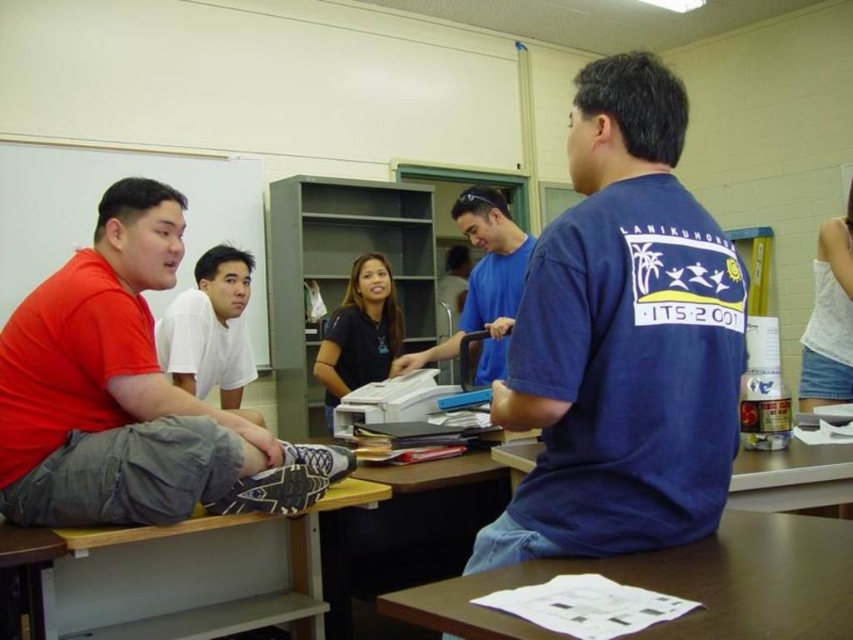
You are trying to place a large rectangular box on the wooden table at lower left. The box is as wide as the blue cotton shirt at center. Will the box fit on the table?

The wooden table at lower left might be wider than blue cotton shirt at center, so the box might fit if the table is wide enough. However, since the exact width difference isn t specified, there s uncertainty.

You are standing at the entrance of the room and want to greet the person in the blue cotton shirt at upper right. Which direction should you walk to approach them?

The blue cotton shirt at upper right is located at point 0.533 on the x axis and 0.730 on the y axis, so you should walk towards the upper right direction to approach them.

You are a person who needs to place a 15 cm tall book on the wooden table at lower left. Considering the height of the blue cotton shirt at center, will the book be visible from the front of the table?

The wooden table at lower left has a lesser height compared to blue cotton shirt at center. Since the table is shorter than the shirt, the 15 cm tall book placed on it may be partially or fully obscured by the blue cotton shirt at center depending on their proximity.